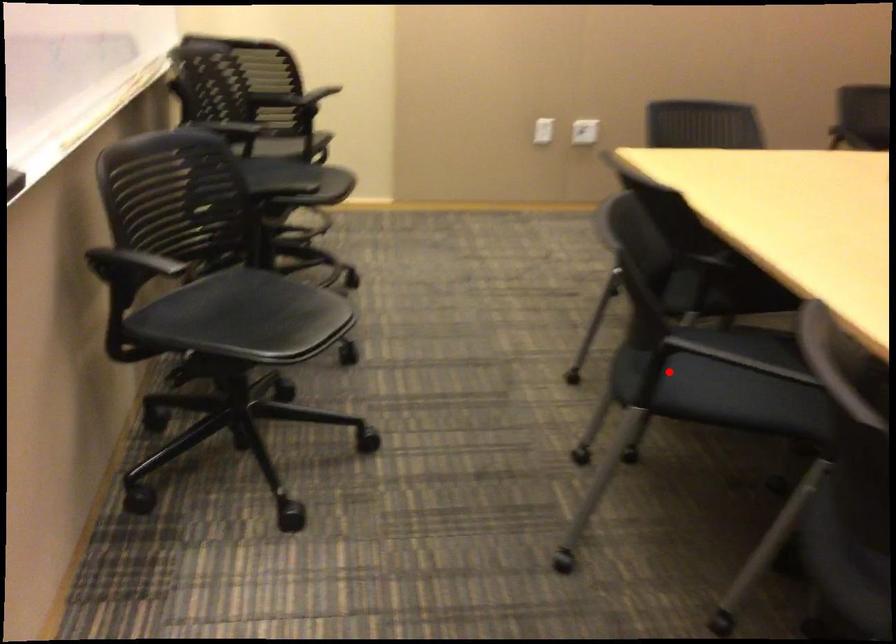
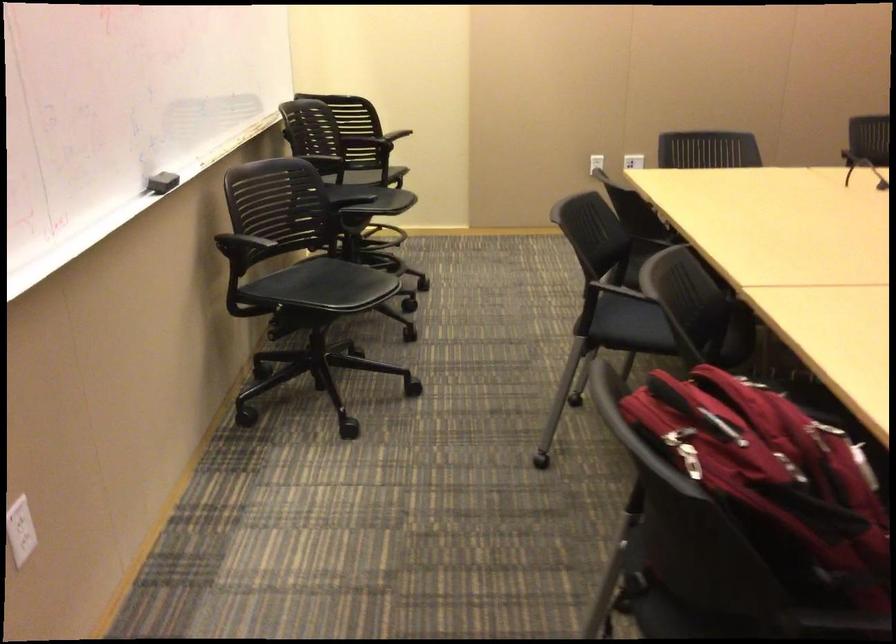
Question: I am providing you with two images of the same scene from different viewpoints. A red point is shown in image1. For the corresponding object point in image2, is it positioned nearer or farther from the camera?

Choices:
 (A) Nearer
 (B) Farther

Answer: (B)